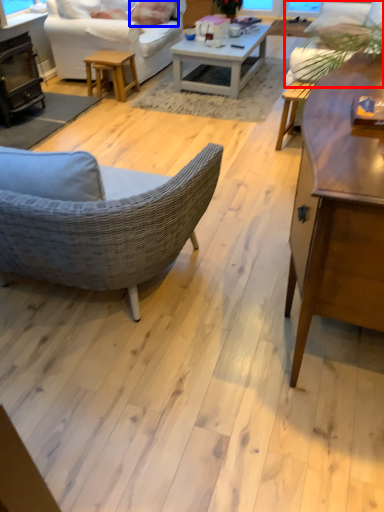
Question: Which point is closer to the camera, couch (highlighted by a red box) or pillow (highlighted by a blue box)?

Choices:
 (A) couch
 (B) pillow

Answer: (A)